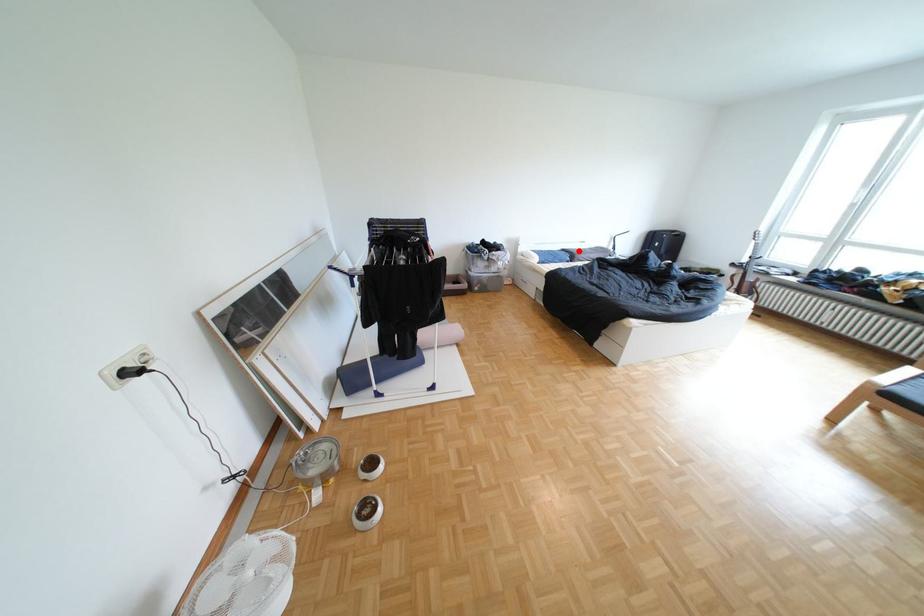
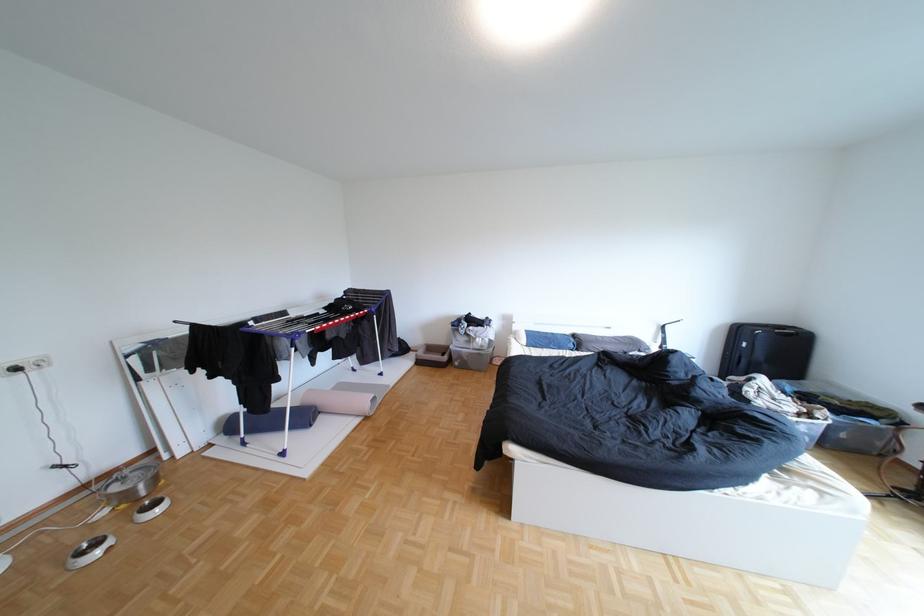
Locate, in the second image, the point that corresponds to the highlighted location in the first image.

(590, 336)